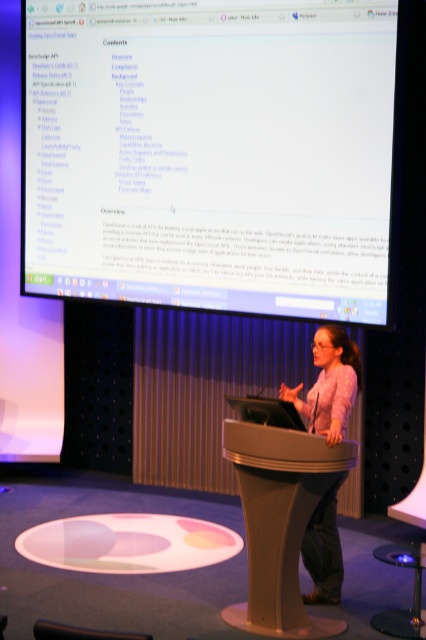
Question: Which point is closer to the camera?

Choices:
 (A) matte gray podium at center
 (B) white glossy projection screen at upper center

Answer: (A)

Question: Which object is closer to the camera taking this photo?

Choices:
 (A) matte gray podium at center
 (B) pink fabric at center
 (C) metallic stool at lower right

Answer: (A)

Question: Which of the following is the farthest from the observer?

Choices:
 (A) white glossy projection screen at upper center
 (B) matte gray podium at center
 (C) metallic stool at lower right

Answer: (A)

Question: Is white glossy projection screen at upper center below matte gray podium at center?

Choices:
 (A) yes
 (B) no

Answer: (B)

Question: Can you confirm if matte gray podium at center is positioned above metallic stool at lower right?

Choices:
 (A) no
 (B) yes

Answer: (B)

Question: Where is pink fabric at center located in relation to metallic stool at lower right in the image?

Choices:
 (A) below
 (B) above

Answer: (B)